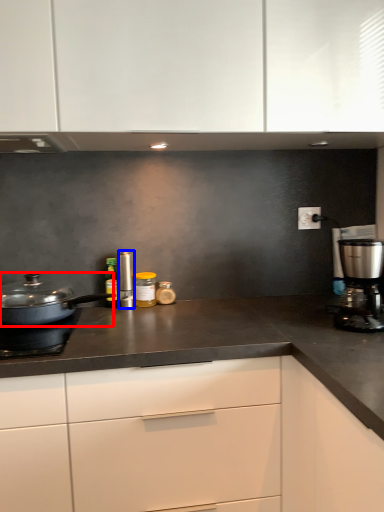
Question: Which point is further to the camera, home appliance (highlighted by a red box) or kitchen appliance (highlighted by a blue box)?

Choices:
 (A) home appliance
 (B) kitchen appliance

Answer: (B)